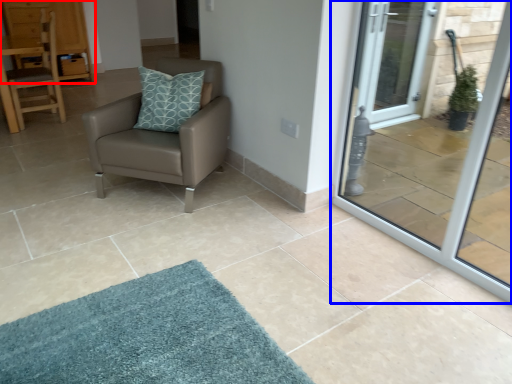
Question: Which point is further to the camera, dresser (highlighted by a red box) or door (highlighted by a blue box)?

Choices:
 (A) dresser
 (B) door

Answer: (A)